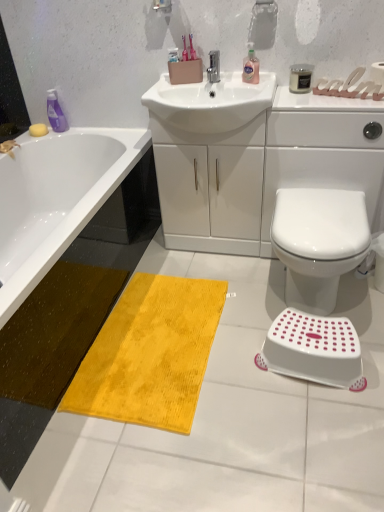
What do you see at coordinates (214, 66) in the screenshot?
I see `silver metallic faucet at center` at bounding box center [214, 66].

The image size is (384, 512). What do you see at coordinates (254, 158) in the screenshot? I see `white glossy sink at center` at bounding box center [254, 158].

In order to click on yellow plush mat at lower left in this screenshot , I will do `click(48, 352)`.

This screenshot has width=384, height=512. What do you see at coordinates (313, 348) in the screenshot? I see `white plastic step stool at lower right` at bounding box center [313, 348].

This screenshot has height=512, width=384. What are the coordinates of `yellow plush bath mat at center` in the screenshot? It's located at point(150,354).

I want to click on yellow sponge at upper left, so click(38, 130).

Find the location of a particular element. The image size is (384, 512). silver metallic faucet at center is located at coordinates (214, 66).

From a real-world perspective, is satin black candle at upper right on top of pink translucent liquid at upper center, which is the 1th cleaning product in right-to-left order?

No, from a real-world perspective, satin black candle at upper right is not over pink translucent liquid at upper center, which is the 1th cleaning product in right-to-left order

From the picture: How distant is satin black candle at upper right from pink translucent liquid at upper center, the 2th cleaning product positioned from the left?

A distance of 7.42 inches exists between satin black candle at upper right and pink translucent liquid at upper center, the 2th cleaning product positioned from the left.

What's the angular difference between satin black candle at upper right and pink translucent liquid at upper center, which appears as the 2th cleaning product when viewed from the back,'s facing directions?

0.000335 degrees.

Where is `cleaning product that appears above the satin black candle at upper right (from a real-world perspective)`? This screenshot has width=384, height=512. cleaning product that appears above the satin black candle at upper right (from a real-world perspective) is located at coordinates (250, 66).

Is satin black candle at upper right inside or outside of purple plastic bottle at upper left, the first cleaning product viewed from the left?

satin black candle at upper right is located beyond the bounds of purple plastic bottle at upper left, the first cleaning product viewed from the left.

From the image's perspective, which one is positioned higher, satin black candle at upper right or purple plastic bottle at upper left, the first cleaning product viewed from the left?

satin black candle at upper right is shown above in the image.

Considering the positions of point (305, 91) and point (47, 95), is point (305, 91) closer or farther from the camera than point (47, 95)?

Point (305, 91).

From a real-world perspective, is silver metallic faucet at center on purple plastic bottle at upper left, arranged as the second cleaning product when viewed from the right?

Correct, in the physical world, silver metallic faucet at center is higher than purple plastic bottle at upper left, arranged as the second cleaning product when viewed from the right.

Looking at this image, from the image's perspective, would you say silver metallic faucet at center is shown under purple plastic bottle at upper left, which ranks as the first cleaning product in back-to-front order?

Actually, silver metallic faucet at center appears above purple plastic bottle at upper left, which ranks as the first cleaning product in back-to-front order, in the image.

Consider the image. Which of these two, silver metallic faucet at center or purple plastic bottle at upper left, arranged as the second cleaning product when viewed from the right, stands taller?

purple plastic bottle at upper left, arranged as the second cleaning product when viewed from the right.

How many degrees apart are the facing directions of silver metallic faucet at center and purple plastic bottle at upper left, arranged as the second cleaning product when viewed from the right?

The angular difference between silver metallic faucet at center and purple plastic bottle at upper left, arranged as the second cleaning product when viewed from the right, is 1.15 degrees.

Choose the correct answer: Is white glossy toilet at lower right inside silver metallic faucet at center or outside it?

white glossy toilet at lower right is located beyond the bounds of silver metallic faucet at center.

Is silver metallic faucet at center at the back of white glossy toilet at lower right?

No, white glossy toilet at lower right is not facing away from silver metallic faucet at center.

Which object is wider, white glossy toilet at lower right or silver metallic faucet at center?

white glossy toilet at lower right is wider.

From a real-world perspective, who is located lower, white glossy toilet at lower right or silver metallic faucet at center?

In real-world perspective, white glossy toilet at lower right is lower.

From the image's perspective, which is above, yellow plush bath mat at center or satin black candle at upper right?

satin black candle at upper right.

This screenshot has width=384, height=512. I want to click on toiletry above the yellow plush bath mat at center (from the image's perspective), so click(x=300, y=78).

Does point (213, 293) appear closer or farther from the camera than point (304, 87)?

Point (213, 293) is positioned farther from the camera compared to point (304, 87).

Considering the relative sizes of white glossy sink at center and white glossy toilet at lower right in the image provided, is white glossy sink at center taller than white glossy toilet at lower right?

Yes.

Is white glossy sink at center at the left side of white glossy toilet at lower right?

Yes, white glossy sink at center is to the left of white glossy toilet at lower right.

Considering the relative positions of white glossy sink at center and white glossy toilet at lower right in the image provided, is white glossy sink at center in front of white glossy toilet at lower right?

No, the depth of white glossy sink at center is greater than that of white glossy toilet at lower right.

Between white glossy sink at center and white glossy toilet at lower right, which one is positioned behind?

white glossy sink at center is further away from the camera.

Is white glossy sink at center touching white glossy toilet at lower right?

They are not placed beside each other.

Between point (189, 110) and point (317, 265), which one is positioned behind?

The point (189, 110) is behind.

You are a GUI agent. You are given a task and a screenshot of the screen. Output one action in this format:
    pyautogui.click(x=<x>, y=<y>)
    Task: Click on the cleaning product that is the 1st one when counting backward from the satin black candle at upper right
    
    Given the screenshot: What is the action you would take?
    pyautogui.click(x=250, y=66)

Identify the location of toiletry on the right side of purple plastic bottle at upper left, arranged as the second cleaning product when viewed from the right. Image resolution: width=384 pixels, height=512 pixels. (300, 78).

Which object lies further to the anchor point yellow plush bath mat at center, yellow sponge at upper left or satin black candle at upper right?

yellow sponge at upper left.

Estimate the real-world distances between objects in this image. Which object is closer to white glossy toilet at lower right, yellow plush bath mat at center or pink translucent liquid at upper center, which appears as the 2th cleaning product when viewed from the back?

yellow plush bath mat at center.

Based on their spatial positions, is purple plastic bottle at upper left, the second cleaning product viewed from the front, or yellow sponge at upper left closer to white plastic step stool at lower right?

Based on the image, purple plastic bottle at upper left, the second cleaning product viewed from the front, appears to be nearer to white plastic step stool at lower right.

Estimate the real-world distances between objects in this image. Which object is closer to white plastic step stool at lower right, white glossy sink at center or yellow sponge at upper left?

The object closer to white plastic step stool at lower right is white glossy sink at center.

Considering their positions, is white plastic step stool at lower right positioned closer to yellow plush bath mat at center than silver metallic faucet at center?

Among the two, white plastic step stool at lower right is located nearer to yellow plush bath mat at center.

From the image, which object appears to be nearer to yellow sponge at upper left, white glossy sink at center or pink translucent liquid at upper center, which appears as the 2th cleaning product when viewed from the back?

white glossy sink at center is closer to yellow sponge at upper left.

From the image, which object appears to be farther from silver metallic faucet at center, yellow plush mat at lower left or pink translucent liquid at upper center, which appears as the 2th cleaning product when viewed from the back?

The object further to silver metallic faucet at center is yellow plush mat at lower left.

Which object lies further to the anchor point yellow plush bath mat at center, white glossy sink at center or silver metallic faucet at center?

silver metallic faucet at center is positioned further to the anchor yellow plush bath mat at center.

Identify the location of doormat that lies between silver metallic faucet at center and yellow plush bath mat at center from top to bottom. (48, 352).

Identify the location of bidet between white glossy sink at center and white plastic step stool at lower right in the up-down direction. Image resolution: width=384 pixels, height=512 pixels. (318, 242).

The image size is (384, 512). Identify the location of beach towel between yellow plush mat at lower left and yellow sponge at upper left from front to back. (150, 354).

The width and height of the screenshot is (384, 512). In order to click on bidet between satin black candle at upper right and yellow plush bath mat at center in the up-down direction in this screenshot , I will do `click(318, 242)`.